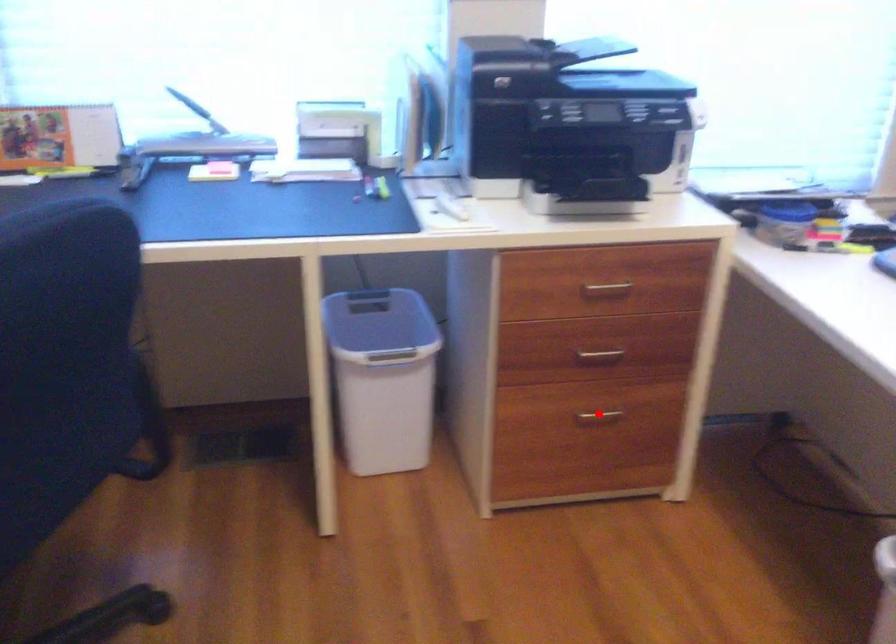
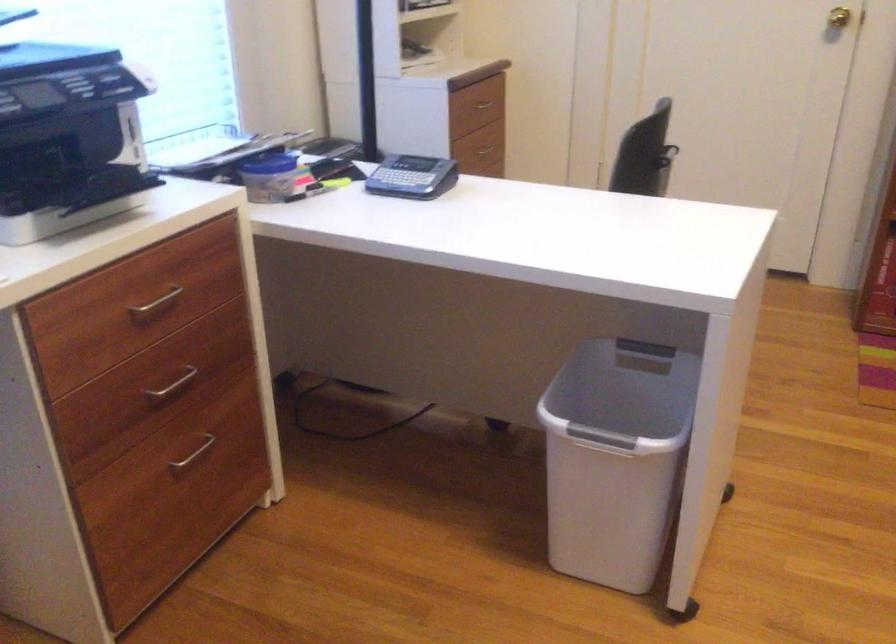
Find the pixel in the second image that matches the highlighted location in the first image.

(193, 453)